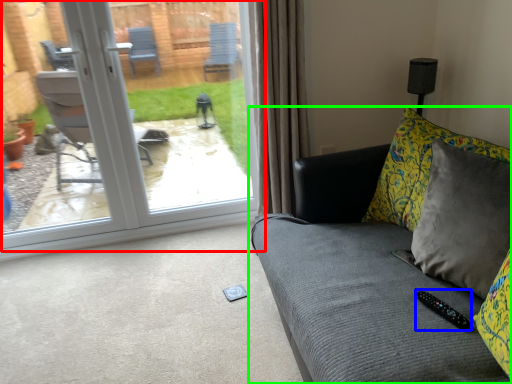
Question: Considering the real-world distances, which object is farthest from door (highlighted by a red box)? remote (highlighted by a blue box) or studio couch (highlighted by a green box)?

Choices:
 (A) remote
 (B) studio couch

Answer: (A)